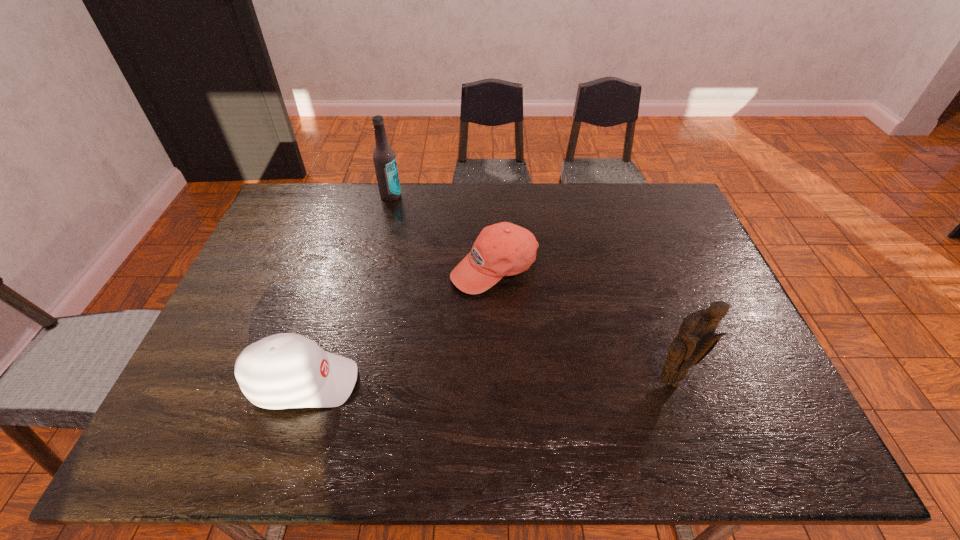
At what (x,y) coordinates should I click in order to perform the action: click on vacant spot on the desktop that is between the left baseball cap and the rightmost object and is positioned on the front-facing side of the second object from right to left. Please return your answer as a coordinate pair (x, y). Image resolution: width=960 pixels, height=540 pixels. Looking at the image, I should click on (501, 382).

Where is `free space on the desktop that is between the nearer baseball cap and the figurine and is positioned on the label of the farthest object`? free space on the desktop that is between the nearer baseball cap and the figurine and is positioned on the label of the farthest object is located at coordinates (444, 382).